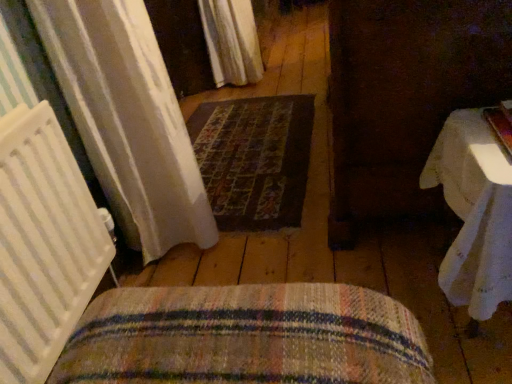
This screenshot has height=384, width=512. What do you see at coordinates (245, 337) in the screenshot? I see `woven fabric cushion at lower center` at bounding box center [245, 337].

What do you see at coordinates (254, 159) in the screenshot? I see `dark brown woven mat at center` at bounding box center [254, 159].

Measure the distance between white cloth-covered table at right and camera.

white cloth-covered table at right is 33.59 inches away from camera.

What are the coordinates of `woven fabric cushion at lower center` in the screenshot? It's located at (245, 337).

From the image's perspective, is white cloth-covered table at right on top of white sheer curtain at upper center?

No.

Is point (474, 185) positioned after point (231, 63)?

No, (474, 185) is closer to viewer.

Consider the image. How different are the orientations of white cloth-covered table at right and white sheer curtain at upper center in degrees?

white cloth-covered table at right and white sheer curtain at upper center are facing 1.02 degrees away from each other.

Is the depth of white cloth-covered table at right less than that of white sheer curtain at upper center?

Yes, white cloth-covered table at right is in front of white sheer curtain at upper center.

Between white sheer curtain at upper center and dark brown woven mat at center, which one has smaller size?

Smaller between the two is dark brown woven mat at center.

Considering the relative sizes of white sheer curtain at upper center and dark brown woven mat at center in the image provided, is white sheer curtain at upper center shorter than dark brown woven mat at center?

In fact, white sheer curtain at upper center may be taller than dark brown woven mat at center.

From a real-world perspective, who is located higher, white sheer curtain at upper center or dark brown woven mat at center?

In real-world perspective, white sheer curtain at upper center is above.

Which is nearer, (60, 357) or (472, 313)?

The point (60, 357) is closer to the camera.

Is woven fabric cushion at lower center at the right side of white cloth-covered table at right?

In fact, woven fabric cushion at lower center is to the left of white cloth-covered table at right.

Is woven fabric cushion at lower center in front of or behind white cloth-covered table at right in the image?

woven fabric cushion at lower center is in front of white cloth-covered table at right.

How different are the orientations of woven fabric cushion at lower center and white cloth-covered table at right in degrees?

They differ by 1.76 degrees in their facing directions.

Is woven fabric cushion at lower center to the left or to the right of dark brown woven mat at center in the image?

woven fabric cushion at lower center is to the right of dark brown woven mat at center.

Is woven fabric cushion at lower center aimed at dark brown woven mat at center?

No, woven fabric cushion at lower center is not facing towards dark brown woven mat at center.

Does point (343, 316) appear closer or farther from the camera than point (273, 225)?

Point (343, 316) appears to be closer to the viewer than point (273, 225).

Considering the sizes of objects white cloth-covered table at right and dark brown woven mat at center in the image provided, who is taller, white cloth-covered table at right or dark brown woven mat at center?

With more height is white cloth-covered table at right.

Would you consider white cloth-covered table at right to be distant from dark brown woven mat at center?

No, white cloth-covered table at right is not far away from dark brown woven mat at center.

From the picture: Which object is further away from the camera, white cloth-covered table at right or dark brown woven mat at center?

dark brown woven mat at center.

Do you think white cloth-covered table at right is within dark brown woven mat at center, or outside of it?

white cloth-covered table at right is not enclosed by dark brown woven mat at center.

From a real-world perspective, does white cloth-covered table at right stand above woven fabric cushion at lower center?

Incorrect, from a real-world perspective, white cloth-covered table at right is lower than woven fabric cushion at lower center.

Locate an element on the screen. The image size is (512, 384). table on the right of woven fabric cushion at lower center is located at coordinates (474, 212).

Considering the relative sizes of white cloth-covered table at right and woven fabric cushion at lower center in the image provided, is white cloth-covered table at right smaller than woven fabric cushion at lower center?

Yes.

In the scene shown: Is white cloth-covered table at right not near woven fabric cushion at lower center?

No, white cloth-covered table at right is in close proximity to woven fabric cushion at lower center.

Could you tell me if woven fabric cushion at lower center is turned towards white sheer curtain at upper center?

No, woven fabric cushion at lower center is not oriented towards white sheer curtain at upper center.

Looking at this image, can you confirm if woven fabric cushion at lower center is bigger than white sheer curtain at upper center?

Incorrect, woven fabric cushion at lower center is not larger than white sheer curtain at upper center.

From a real-world perspective, who is located higher, woven fabric cushion at lower center or white sheer curtain at upper center?

From a 3D spatial view, woven fabric cushion at lower center is above.

Which is more to the left, woven fabric cushion at lower center or white sheer curtain at upper center?

woven fabric cushion at lower center.

Locate an element on the screen. The width and height of the screenshot is (512, 384). table directly beneath the white sheer curtain at upper center (from a real-world perspective) is located at coordinates (474, 212).

Where is `curtain above the dark brown woven mat at center (from a real-world perspective)`? curtain above the dark brown woven mat at center (from a real-world perspective) is located at coordinates 232,41.

Estimate the real-world distances between objects in this image. Which object is further from dark brown woven mat at center, white sheer curtain at upper center or white cloth-covered table at right?

white sheer curtain at upper center is further to dark brown woven mat at center.

Estimate the real-world distances between objects in this image. Which object is further from white sheer curtain at upper center, woven fabric cushion at lower center or dark brown woven mat at center?

woven fabric cushion at lower center is further to white sheer curtain at upper center.

Looking at the image, which one is located closer to white sheer curtain at upper center, white cloth-covered table at right or dark brown woven mat at center?

The object closer to white sheer curtain at upper center is dark brown woven mat at center.

When comparing their distances from white sheer curtain at upper center, does dark brown woven mat at center or white cloth-covered table at right seem closer?

dark brown woven mat at center is positioned closer to the anchor white sheer curtain at upper center.

Considering their positions, is woven fabric cushion at lower center positioned further to white cloth-covered table at right than white sheer curtain at upper center?

Among the two, white sheer curtain at upper center is located further to white cloth-covered table at right.

Based on their spatial positions, is dark brown woven mat at center or white sheer curtain at upper center closer to woven fabric cushion at lower center?

dark brown woven mat at center is positioned closer to the anchor woven fabric cushion at lower center.

Based on their spatial positions, is white sheer curtain at upper center or dark brown woven mat at center further from woven fabric cushion at lower center?

white sheer curtain at upper center.

When comparing their distances from woven fabric cushion at lower center, does white cloth-covered table at right or dark brown woven mat at center seem further?

dark brown woven mat at center.

At what (x,y) coordinates should I click in order to perform the action: click on mat between woven fabric cushion at lower center and white sheer curtain at upper center in the front-back direction. Please return your answer as a coordinate pair (x, y). The height and width of the screenshot is (384, 512). Looking at the image, I should click on (254, 159).

The width and height of the screenshot is (512, 384). Find the location of `mat located between white cloth-covered table at right and white sheer curtain at upper center in the depth direction`. mat located between white cloth-covered table at right and white sheer curtain at upper center in the depth direction is located at coordinates (254, 159).

Identify the location of table located between woven fabric cushion at lower center and dark brown woven mat at center in the depth direction. This screenshot has width=512, height=384. (474, 212).

This screenshot has width=512, height=384. In order to click on table between woven fabric cushion at lower center and white sheer curtain at upper center along the z-axis in this screenshot , I will do `click(474, 212)`.